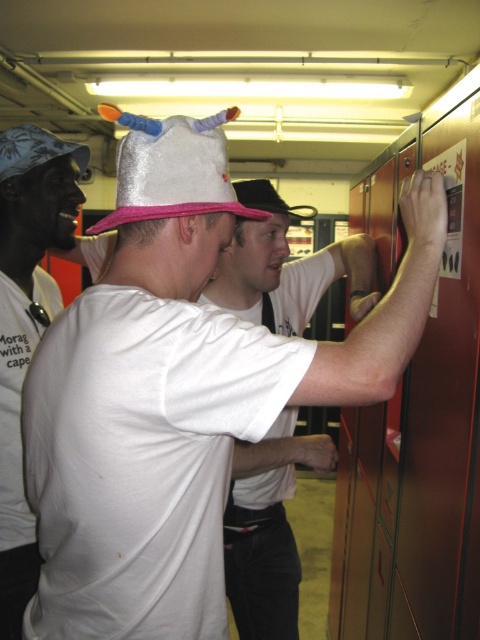
You are an observer in the locker room scene. You notice the blue fabric cap at upper left and the shiny metallic hat at upper left. Which of these two items is positioned lower in the image?

The blue fabric cap at upper left is located below the shiny metallic hat at upper left, so it is positioned lower in the image.

You are a photographer setting up a shoot in the locker room. You need to position a spotlight so that it illuminates both the white matte shirt at center and the shiny metallic hat at upper left. Based on their positions, where should you place the spotlight to ensure both are lit adequately?

The white matte shirt at center is below the shiny metallic hat at upper left, so placing the spotlight above the shiny metallic hat at upper left would illuminate both objects effectively.

You are standing in the locker room and see the white matte shirt at center and the shiny metallic hat at upper left. Which object is positioned more to the left?

The shiny metallic hat at upper left is positioned more to the left than the white matte shirt at center.